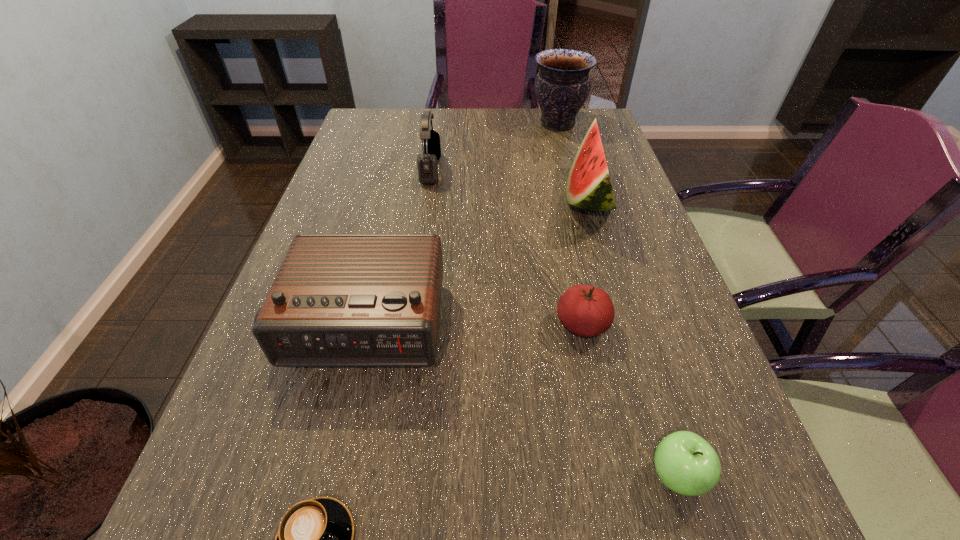
What are the coordinates of `apple that is at the right edge` in the screenshot? It's located at (687, 464).

The width and height of the screenshot is (960, 540). What are the coordinates of `object situated at the far right corner` in the screenshot? It's located at (562, 85).

You are a GUI agent. You are given a task and a screenshot of the screen. Output one action in this format:
    pyautogui.click(x=<x>, y=<y>)
    Task: Click on the blank area at the far edge
    
    Given the screenshot: What is the action you would take?
    pyautogui.click(x=503, y=125)

You are a GUI agent. You are given a task and a screenshot of the screen. Output one action in this format:
    pyautogui.click(x=<x>, y=<y>)
    Task: Click on the blank area at the left edge
    
    Given the screenshot: What is the action you would take?
    pyautogui.click(x=369, y=150)

Identify the location of vacant region at the right edge of the desktop. Image resolution: width=960 pixels, height=540 pixels. (612, 269).

In the image, there is a desktop. Where is `blank space at the far left corner`? Image resolution: width=960 pixels, height=540 pixels. blank space at the far left corner is located at coordinates pos(353,131).

Find the location of `free space between the tomato and the radio receiver`. free space between the tomato and the radio receiver is located at coordinates (472, 325).

Identify the location of vacant region between the tomato and the farthest object. The image size is (960, 540). 570,225.

Identify the location of free space between the tomato and the watermelon. (585, 262).

Find the location of a particular element. free space between the watermelon and the headset is located at coordinates (510, 184).